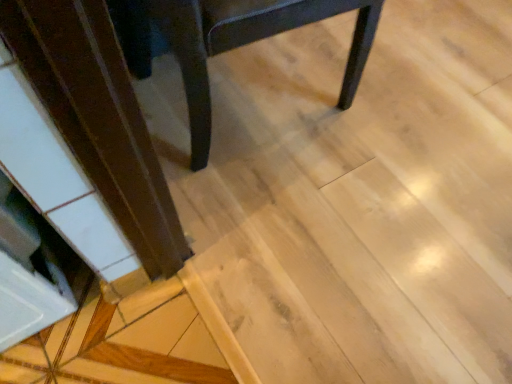
What do you see at coordinates (227, 42) in the screenshot?
I see `matte black chair at center` at bounding box center [227, 42].

Measure the distance between matte black chair at center and camera.

matte black chair at center and camera are 28.17 inches apart from each other.

This screenshot has width=512, height=384. In order to click on matte black chair at center in this screenshot , I will do `click(227, 42)`.

You are a GUI agent. You are given a task and a screenshot of the screen. Output one action in this format:
    pyautogui.click(x=<x>, y=<y>)
    Task: Click on the light brown wood at lower left
    This screenshot has height=384, width=512.
    Given the screenshot: What is the action you would take?
    pyautogui.click(x=98, y=118)

The width and height of the screenshot is (512, 384). Describe the element at coordinates (98, 118) in the screenshot. I see `light brown wood at lower left` at that location.

In order to click on matte black chair at center in this screenshot , I will do `click(227, 42)`.

Visually, is matte black chair at center positioned to the left or to the right of light brown wood at lower left?

Clearly, matte black chair at center is on the right of light brown wood at lower left in the image.

Is matte black chair at center positioned in front of light brown wood at lower left?

That is True.

Is point (360, 67) positioned before point (95, 96)?

No.

From the image's perspective, is matte black chair at center located above light brown wood at lower left?

Yes, from the image's perspective, matte black chair at center is above light brown wood at lower left.

From a real-world perspective, which object rests below the other?

light brown wood at lower left is physically lower.

Considering the sizes of objects matte black chair at center and light brown wood at lower left in the image provided, who is wider, matte black chair at center or light brown wood at lower left?

With larger width is matte black chair at center.

In terms of height, does matte black chair at center look taller or shorter compared to light brown wood at lower left?

In the image, matte black chair at center appears to be taller than light brown wood at lower left.

Who is smaller, matte black chair at center or light brown wood at lower left?

light brown wood at lower left is smaller.

Is matte black chair at center completely or partially outside of light brown wood at lower left?

Yes, matte black chair at center is located beyond the bounds of light brown wood at lower left.

Is matte black chair at center touching light brown wood at lower left?

No, matte black chair at center is not making contact with light brown wood at lower left.

Consider the image. Could you tell me if matte black chair at center is turned towards light brown wood at lower left?

No.

In the scene shown: How far apart are matte black chair at center and light brown wood at lower left?

matte black chair at center is 14.89 inches from light brown wood at lower left.

Locate an element on the screen. This screenshot has width=512, height=384. wood located below the matte black chair at center (from the image's perspective) is located at coordinates (98, 118).

In the image, is light brown wood at lower left on the left side or the right side of matte black chair at center?

From the image, it's evident that light brown wood at lower left is to the left of matte black chair at center.

Relative to matte black chair at center, is light brown wood at lower left in front or behind?

Clearly, light brown wood at lower left is behind matte black chair at center.

Is point (24, 67) positioned in front of point (364, 10)?

Yes, it is in front of point (364, 10).

From the image's perspective, is light brown wood at lower left below matte black chair at center?

Yes.

From a real-world perspective, which is physically below, light brown wood at lower left or matte black chair at center?

light brown wood at lower left, from a real-world perspective.

Which object is wider, light brown wood at lower left or matte black chair at center?

With larger width is matte black chair at center.

Considering the sizes of objects light brown wood at lower left and matte black chair at center in the image provided, who is taller, light brown wood at lower left or matte black chair at center?

Standing taller between the two is matte black chair at center.

Between light brown wood at lower left and matte black chair at center, which one has larger size?

matte black chair at center.

Is light brown wood at lower left situated inside matte black chair at center or outside?

light brown wood at lower left is spatially situated outside matte black chair at center.

Is light brown wood at lower left positioned far away from matte black chair at center?

light brown wood at lower left is actually quite close to matte black chair at center.

Is light brown wood at lower left aimed at matte black chair at center?

No.

Can you tell me how much light brown wood at lower left and matte black chair at center differ in facing direction?

The angular difference between light brown wood at lower left and matte black chair at center is 3.34 degrees.

Measure the distance between light brown wood at lower left and matte black chair at center.

light brown wood at lower left is 14.89 inches from matte black chair at center.

At what (x,y) coordinates should I click in order to perform the action: click on wood behind the matte black chair at center. Please return your answer as a coordinate pair (x, y). Image resolution: width=512 pixels, height=384 pixels. Looking at the image, I should click on pyautogui.click(x=98, y=118).

At what (x,y) coordinates should I click in order to perform the action: click on wood located below the matte black chair at center (from the image's perspective). Please return your answer as a coordinate pair (x, y). This screenshot has width=512, height=384. Looking at the image, I should click on (98, 118).

Where is `chair that appears above the light brown wood at lower left (from a real-world perspective)`? The height and width of the screenshot is (384, 512). chair that appears above the light brown wood at lower left (from a real-world perspective) is located at coordinates [227, 42].